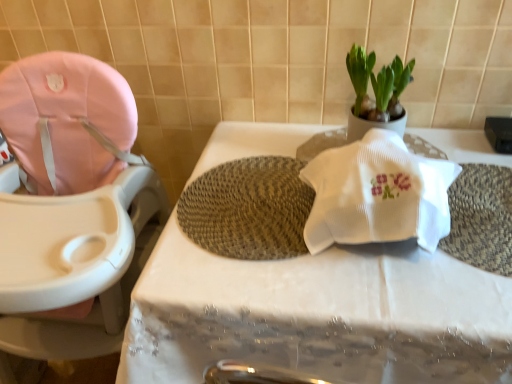
Locate an element on the screen. The image size is (512, 384). unoccupied space behind woven beige bath mat at center is located at coordinates click(x=273, y=138).